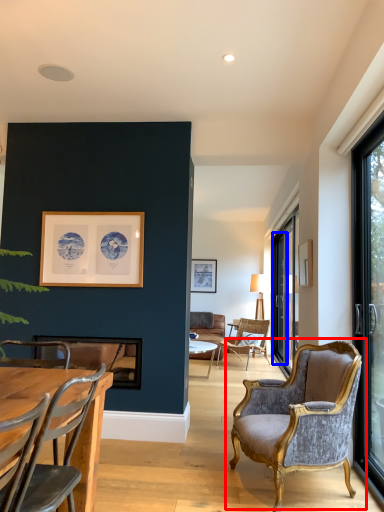
Question: Which of the following is the closest to the observer, chair (highlighted by a red box) or screen door (highlighted by a blue box)?

Choices:
 (A) chair
 (B) screen door

Answer: (A)